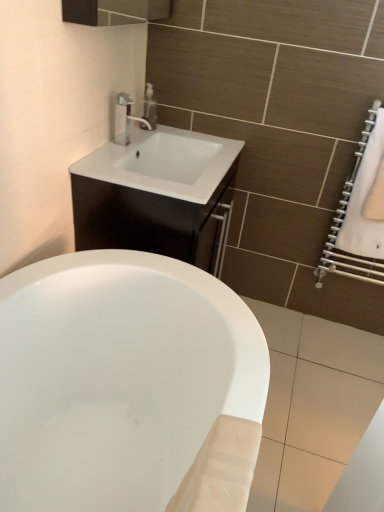
Identify the location of vacant region to the right of matte silver soap dispenser at upper center. (174, 136).